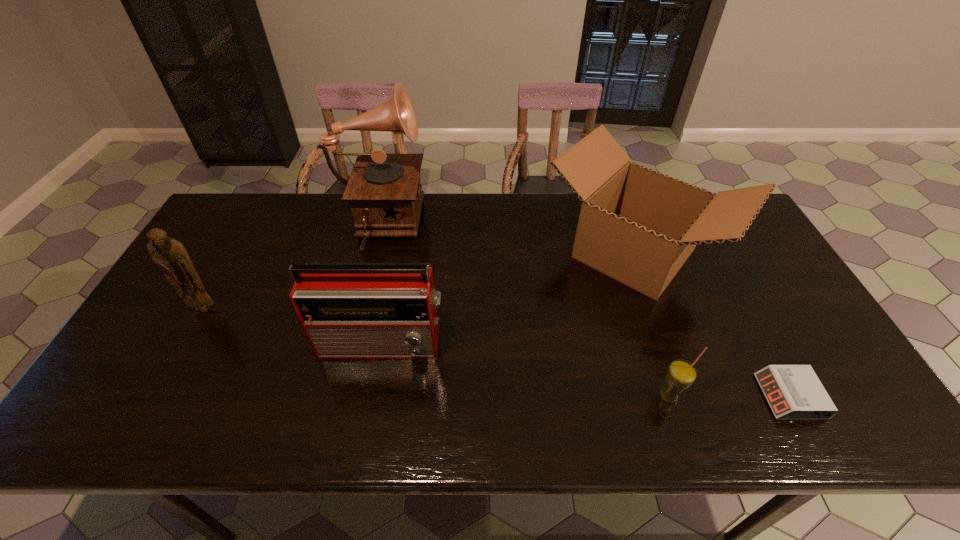
The image size is (960, 540). I want to click on free space located on the right of the straw for drinking, so click(777, 397).

This screenshot has height=540, width=960. I want to click on blank area located 0.150m on the back of the shortest object, so click(x=751, y=325).

Identify the location of record player that is at the far edge. The width and height of the screenshot is (960, 540). (384, 190).

Where is `box that is at the far edge`? This screenshot has width=960, height=540. box that is at the far edge is located at coordinates (638, 226).

At what (x,y) coordinates should I click in order to perform the action: click on straw for drinking located at the near edge. Please return your answer as a coordinate pair (x, y). Looking at the image, I should click on (681, 374).

This screenshot has width=960, height=540. What are the coordinates of `alarm clock at the near edge` in the screenshot? It's located at (794, 392).

The image size is (960, 540). In order to click on object at the left edge in this screenshot , I will do `click(170, 254)`.

What are the coordinates of `box positioned at the right edge` in the screenshot? It's located at (638, 226).

The width and height of the screenshot is (960, 540). I want to click on alarm clock located at the right edge, so click(794, 392).

This screenshot has width=960, height=540. I want to click on object situated at the far right corner, so click(x=638, y=226).